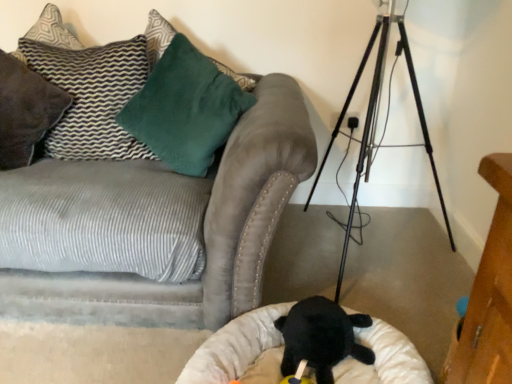
Question: Based on their positions, is white plush cat bed at lower center located to the left or right of textured gray pillow at upper left, positioned as the second pillow in right-to-left order?

Choices:
 (A) right
 (B) left

Answer: (A)

Question: Which is correct: white plush cat bed at lower center is inside textured gray pillow at upper left, positioned as the second pillow in right-to-left order, or outside of it?

Choices:
 (A) inside
 (B) outside

Answer: (B)

Question: Based on their relative distances, which object is farther from the velvety green pillow at upper left, which is the second pillow from left to right?

Choices:
 (A) textured gray pillow at upper left, positioned as the second pillow in right-to-left order
 (B) soft plush toy at center
 (C) white plush cat bed at lower center
 (D) suede gray couch at upper left
 (E) black plush toy at lower center

Answer: (B)

Question: Estimate the real-world distances between objects in this image. Which object is closer to the white plush cat bed at lower center?

Choices:
 (A) velvety green pillow at upper left, arranged as the 1th pillow when viewed from the right
 (B) metallic tripod at center
 (C) suede gray couch at upper left
 (D) black plush toy at lower center
 (E) soft plush toy at center

Answer: (D)